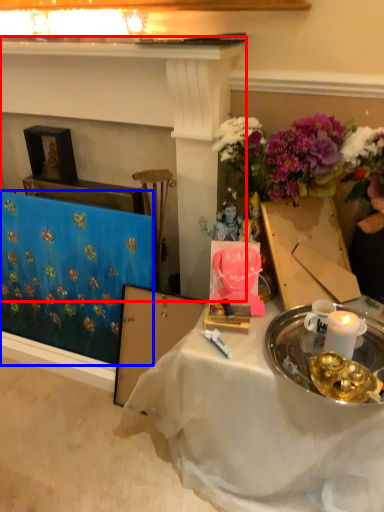
Question: Which of the following is the closest to the observer, fireplace (highlighted by a red box) or tablecloth (highlighted by a blue box)?

Choices:
 (A) fireplace
 (B) tablecloth

Answer: (A)